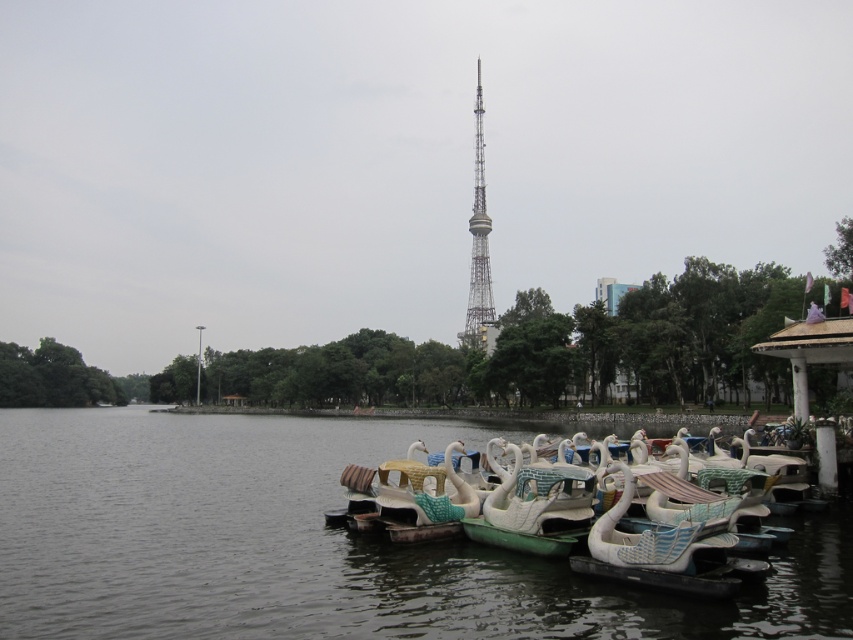
Who is lower down, transparent plastic water at lower right or metallic lattice tower at center?

transparent plastic water at lower right is lower down.

I want to click on transparent plastic water at lower right, so click(x=312, y=544).